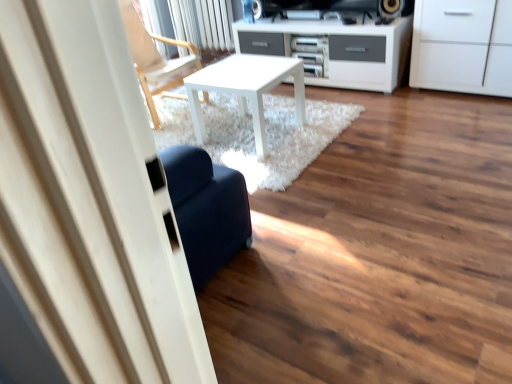
Identify the location of white matte table at center. The width and height of the screenshot is (512, 384). (246, 89).

Which object is thinner, white matte table at center or wooden chair at upper left?

Thinner between the two is white matte table at center.

Is white matte table at center facing towards wooden chair at upper left?

No.

Would you say white matte table at center is outside wooden chair at upper left?

white matte table at center is positioned outside wooden chair at upper left.

From a real-world perspective, between white matte table at center and wooden chair at upper left, who is vertically lower?

In real-world perspective, white matte table at center is lower.

From the picture: Considering the relative sizes of wooden chair at upper left and white matte table at center in the image provided, is wooden chair at upper left bigger than white matte table at center?

Correct, wooden chair at upper left is larger in size than white matte table at center.

Choose the correct answer: Is wooden chair at upper left inside white matte table at center or outside it?

wooden chair at upper left is located beyond the bounds of white matte table at center.

Is wooden chair at upper left in front of or behind white matte table at center in the image?

Visually, wooden chair at upper left is located behind white matte table at center.

Is white matte table at center at the back of wooden chair at upper left?

wooden chair at upper left is not turned away from white matte table at center.

From a real-world perspective, between white matte cabinet at upper right and white matte table at center, who is vertically higher?

white matte cabinet at upper right.

Between white matte cabinet at upper right and white matte table at center, which one appears on the left side from the viewer's perspective?

Positioned to the left is white matte table at center.

From the image's perspective, between white matte cabinet at upper right and white matte table at center, which one is located above?

white matte cabinet at upper right appears higher in the image.

Could you tell me if white matte cabinet at upper right is facing wooden chair at upper left?

No, white matte cabinet at upper right is not facing towards wooden chair at upper left.

Considering the sizes of objects white matte cabinet at upper right and wooden chair at upper left in the image provided, who is wider, white matte cabinet at upper right or wooden chair at upper left?

Wider between the two is wooden chair at upper left.

Considering the positions of objects white matte cabinet at upper right and wooden chair at upper left in the image provided, who is more to the left, white matte cabinet at upper right or wooden chair at upper left?

Positioned to the left is wooden chair at upper left.

From the image's perspective, which one is positioned lower, white matte table at center or white matte cabinet at upper right?

white matte table at center appears lower in the image.

In the image, there is a white matte table at center. In order to click on cabinetry above it (from the image's perspective) in this screenshot , I will do `click(463, 46)`.

Is point (266, 142) farther from camera compared to point (451, 24)?

No, (266, 142) is in front of (451, 24).

How many degrees apart are the facing directions of wooden chair at upper left and white matte cabinet at upper right?

There is a 86.6-degree angle between the facing directions of wooden chair at upper left and white matte cabinet at upper right.

Looking at this image, which of these two, wooden chair at upper left or white matte cabinet at upper right, is wider?

Wider between the two is wooden chair at upper left.

Would you say wooden chair at upper left is a long distance from white matte cabinet at upper right?

Yes.

How far apart are wooden chair at upper left and white matte cabinet at upper right?

wooden chair at upper left is 2.01 meters from white matte cabinet at upper right.

Find the location of a particular element. The image size is (512, 384). chair that is on the left side of white matte table at center is located at coordinates pos(152,57).

There is a white matte table at center. Identify the location of chair above it (from a real-world perspective). (152, 57).

Looking at the image, which one is located closer to white matte cabinet at upper right, wooden chair at upper left or white matte table at center?

white matte table at center lies closer to white matte cabinet at upper right than the other object.

Considering their positions, is white matte table at center positioned further to white matte cabinet at upper right than wooden chair at upper left?

The object further to white matte cabinet at upper right is wooden chair at upper left.

From the image, which object appears to be nearer to white matte table at center, wooden chair at upper left or white matte cabinet at upper right?

The object closer to white matte table at center is wooden chair at upper left.

Estimate the real-world distances between objects in this image. Which object is closer to wooden chair at upper left, white matte table at center or white matte cabinet at upper right?

white matte table at center is positioned closer to the anchor wooden chair at upper left.

From the image, which object appears to be farther from white matte table at center, white matte cabinet at upper right or wooden chair at upper left?

white matte cabinet at upper right lies further to white matte table at center than the other object.

From the image, which object appears to be farther from wooden chair at upper left, white matte cabinet at upper right or white matte table at center?

white matte cabinet at upper right is positioned further to the anchor wooden chair at upper left.

Identify the location of table situated between wooden chair at upper left and white matte cabinet at upper right from left to right. (246, 89).